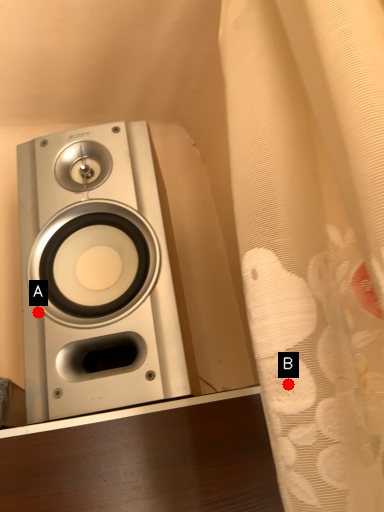
Question: Two points are circled on the image, labeled by A and B beside each circle. Which point is further to the camera?

Choices:
 (A) A is further
 (B) B is further

Answer: (A)